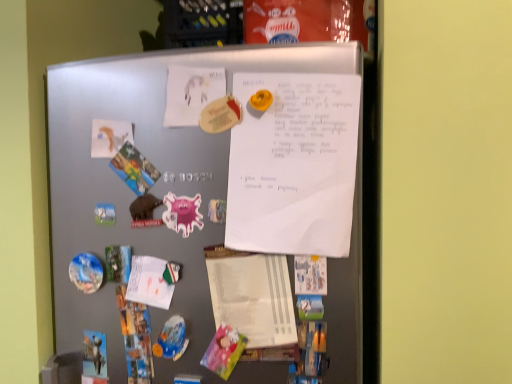
Question: Is pink glossy magnet at center-left looking in the opposite direction of matte paper poster at upper center, the 2th poster when ordered from right to left?

Choices:
 (A) yes
 (B) no

Answer: (B)

Question: From the image's perspective, is pink glossy magnet at center-left beneath matte paper poster at upper center, positioned as the 1th poster in left-to-right order?

Choices:
 (A) no
 (B) yes

Answer: (B)

Question: Is pink glossy magnet at center-left not close to matte paper poster at upper center, positioned as the 1th poster in left-to-right order?

Choices:
 (A) yes
 (B) no

Answer: (B)

Question: Is pink glossy magnet at center-left to the left of matte paper poster at upper center, the 2th poster when ordered from right to left, from the viewer's perspective?

Choices:
 (A) yes
 (B) no

Answer: (A)

Question: From a real-world perspective, is pink glossy magnet at center-left physically below matte paper poster at upper center, positioned as the 1th poster in left-to-right order?

Choices:
 (A) no
 (B) yes

Answer: (B)

Question: Is pink glossy magnet at center-left bigger than matte paper poster at upper center, the 2th poster when ordered from right to left?

Choices:
 (A) yes
 (B) no

Answer: (B)

Question: Considering the relative sizes of white paper at upper center, placed as the 2th poster when sorted from left to right, and matte paper poster at upper center, the 2th poster when ordered from right to left, in the image provided, is white paper at upper center, placed as the 2th poster when sorted from left to right, wider than matte paper poster at upper center, the 2th poster when ordered from right to left,?

Choices:
 (A) no
 (B) yes

Answer: (B)

Question: Is white paper at upper center, placed as the 2th poster when sorted from left to right, smaller than matte paper poster at upper center, the 2th poster when ordered from right to left?

Choices:
 (A) yes
 (B) no

Answer: (B)

Question: Is white paper at upper center, the first poster positioned from the right, oriented towards matte paper poster at upper center, the 2th poster when ordered from right to left?

Choices:
 (A) yes
 (B) no

Answer: (B)

Question: From the image's perspective, would you say white paper at upper center, the first poster positioned from the right, is shown under matte paper poster at upper center, the 2th poster when ordered from right to left?

Choices:
 (A) no
 (B) yes

Answer: (B)

Question: From a real-world perspective, is white paper at upper center, placed as the 2th poster when sorted from left to right, on matte paper poster at upper center, positioned as the 1th poster in left-to-right order?

Choices:
 (A) yes
 (B) no

Answer: (B)

Question: Considering the relative sizes of white paper at upper center, the first poster positioned from the right, and matte paper poster at upper center, the 2th poster when ordered from right to left, in the image provided, is white paper at upper center, the first poster positioned from the right, shorter than matte paper poster at upper center, the 2th poster when ordered from right to left,?

Choices:
 (A) yes
 (B) no

Answer: (B)

Question: Considering the relative sizes of satin silver refrigerator at center and matte paper poster at upper center, positioned as the 1th poster in left-to-right order, in the image provided, is satin silver refrigerator at center bigger than matte paper poster at upper center, positioned as the 1th poster in left-to-right order,?

Choices:
 (A) no
 (B) yes

Answer: (B)